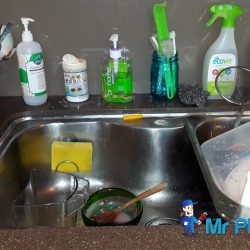
Locate an element on the screen. The width and height of the screenshot is (250, 250). sponge is located at coordinates (70, 156).